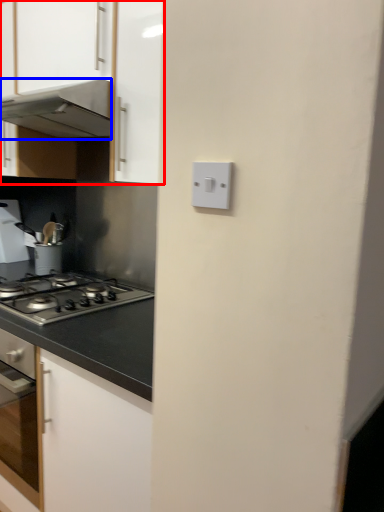
Question: Which object is further to the camera taking this photo, cabinetry (highlighted by a red box) or home appliance (highlighted by a blue box)?

Choices:
 (A) cabinetry
 (B) home appliance

Answer: (B)